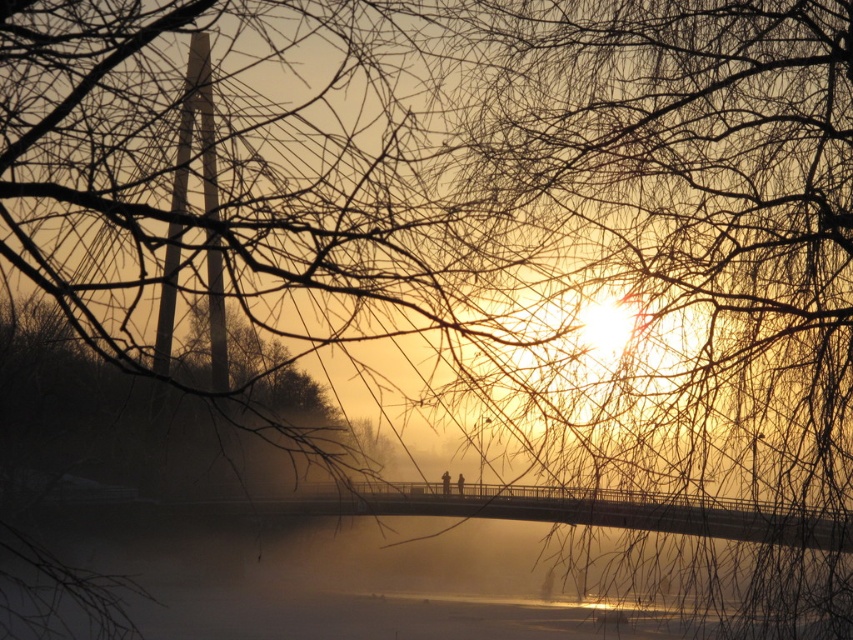
Who is positioned more to the right, translucent misty water at center or brown matte tree at center?

Positioned to the right is translucent misty water at center.

Does translucent misty water at center have a lesser width compared to brown matte tree at center?

Indeed, translucent misty water at center has a lesser width compared to brown matte tree at center.

The width and height of the screenshot is (853, 640). I want to click on translucent misty water at center, so click(x=352, y=570).

Locate an element on the screen. translucent misty water at center is located at coordinates (x=352, y=570).